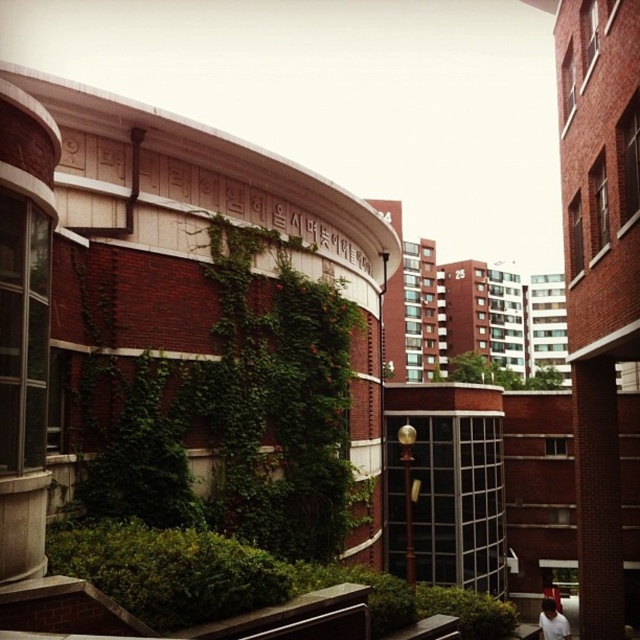
Is green leafy ivy at center thinner than white cotton shirt at lower right?

Incorrect, green leafy ivy at center's width is not less than white cotton shirt at lower right's.

Between green leafy ivy at center and white cotton shirt at lower right, which one is positioned higher?

Positioned higher is green leafy ivy at center.

Does point (477, 372) lie in front of point (540, 612)?

That is False.

Identify the location of green leafy ivy at center. (497, 372).